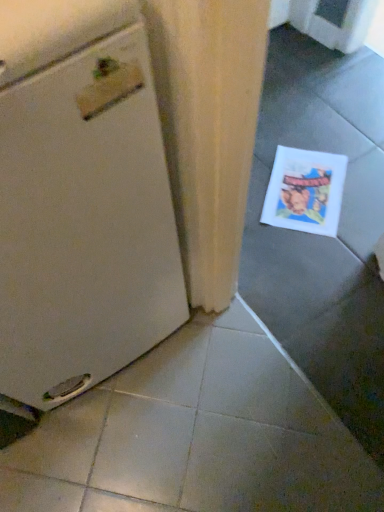
Question: From their relative heights in the image, would you say white paper comic book at lower right is taller or shorter than white matte refrigerator at left?

Choices:
 (A) short
 (B) tall

Answer: (A)

Question: Looking at the image, does white paper comic book at lower right seem bigger or smaller compared to white matte refrigerator at left?

Choices:
 (A) big
 (B) small

Answer: (B)

Question: Is white paper comic book at lower right wider or thinner than white matte refrigerator at left?

Choices:
 (A) wide
 (B) thin

Answer: (B)

Question: Looking at their shapes, would you say white matte refrigerator at left is wider or thinner than white paper comic book at lower right?

Choices:
 (A) thin
 (B) wide

Answer: (B)

Question: Is point (102, 51) closer or farther from the camera than point (331, 220)?

Choices:
 (A) farther
 (B) closer

Answer: (B)

Question: In the image, is white matte refrigerator at left positioned in front of or behind white paper comic book at lower right?

Choices:
 (A) front
 (B) behind

Answer: (A)

Question: From the image's perspective, relative to white paper comic book at lower right, is white matte refrigerator at left above or below?

Choices:
 (A) below
 (B) above

Answer: (A)